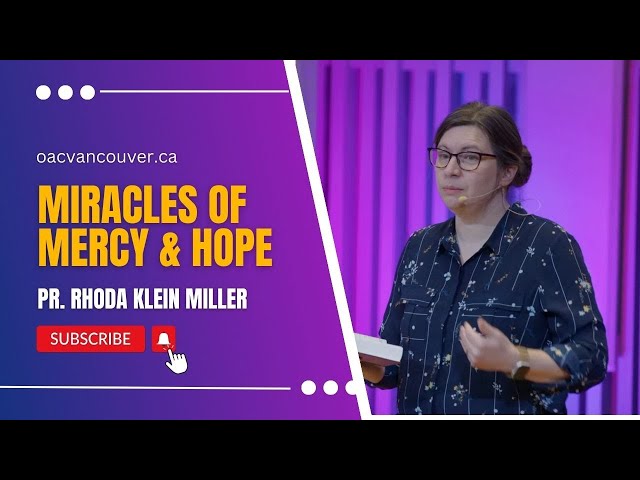
Identify the location of book. The image size is (640, 480). pyautogui.click(x=379, y=352).